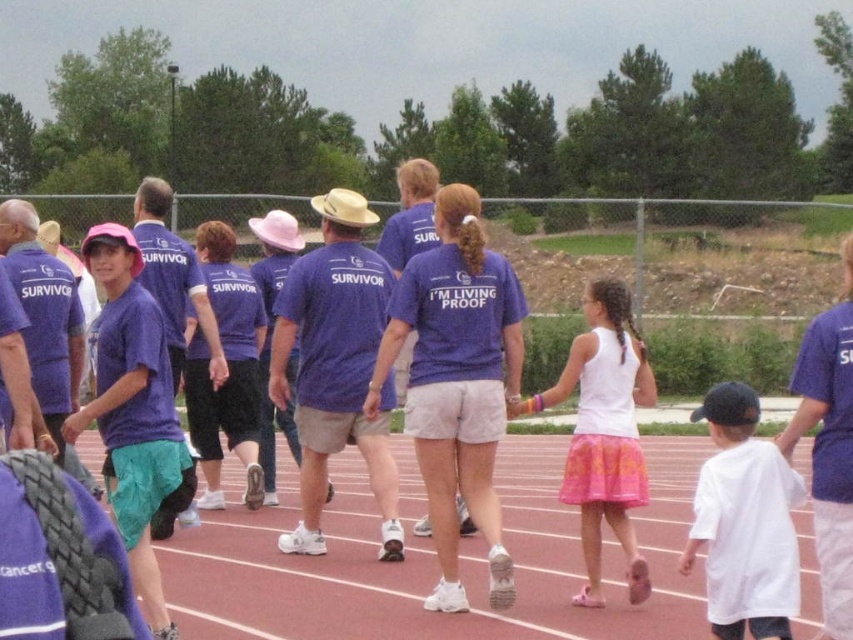
Question: Among these objects, which one is farthest from the camera?

Choices:
 (A) matte purple shirt at center
 (B) white cotton tank top at center

Answer: (B)

Question: Can you confirm if red rubber track at center is wider than white cotton tank top at center?

Choices:
 (A) no
 (B) yes

Answer: (A)

Question: Can you confirm if red rubber track at center is positioned to the right of white cotton tank top at center?

Choices:
 (A) no
 (B) yes

Answer: (B)

Question: Which of these objects is positioned closest to the red rubber track at center?

Choices:
 (A) white cotton shirt at lower right
 (B) matte purple shirt at center

Answer: (A)

Question: Is white cotton shirt at lower right positioned before white cotton tank top at center?

Choices:
 (A) yes
 (B) no

Answer: (A)

Question: Among these objects, which one is nearest to the camera?

Choices:
 (A) white cotton tank top at center
 (B) white cotton shirt at lower right
 (C) matte purple shirt at center

Answer: (B)